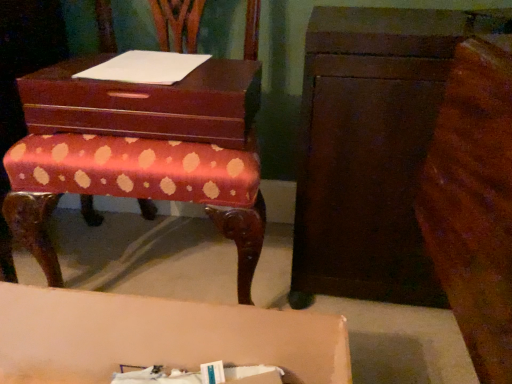
What is the approximate height of dark brown wood chest of drawers at right?

26.48 inches.

What do you see at coordinates (146, 103) in the screenshot?
I see `mahogany wood storage box at center` at bounding box center [146, 103].

At what (x,y) coordinates should I click in order to perform the action: click on white paper at upper center. Please return your answer as a coordinate pair (x, y). Image resolution: width=512 pixels, height=384 pixels. Looking at the image, I should click on (145, 67).

The image size is (512, 384). I want to click on book that is above the matte pink table at lower center (from a real-world perspective), so click(145, 67).

Between white paper at upper center and matte pink table at lower center, which one has more height?

With more height is matte pink table at lower center.

Who is more distant, white paper at upper center or matte pink table at lower center?

Positioned behind is white paper at upper center.

Based on the photo, considering the relative sizes of white paper at upper center and matte pink table at lower center in the image provided, is white paper at upper center thinner than matte pink table at lower center?

No.

Which of these two, white paper at upper center or mahogany wood storage box at center, is bigger?

mahogany wood storage box at center is bigger.

Is white paper at upper center oriented towards mahogany wood storage box at center?

Yes, white paper at upper center is facing mahogany wood storage box at center.

Can you confirm if white paper at upper center is positioned to the left of mahogany wood storage box at center?

Indeed, white paper at upper center is positioned on the left side of mahogany wood storage box at center.

Is white paper at upper center spatially inside mahogany wood storage box at center, or outside of it?

white paper at upper center is contained in mahogany wood storage box at center.

How different are the orientations of mahogany wood storage box at center and polished wood bench at center in degrees?

The angle between the facing direction of mahogany wood storage box at center and the facing direction of polished wood bench at center is 0.522 degrees.

Consider the image. Is mahogany wood storage box at center positioned with its back to polished wood bench at center?

Yes.

Is mahogany wood storage box at center inside or outside of polished wood bench at center?

mahogany wood storage box at center exists entirely within polished wood bench at center.

Can you confirm if mahogany wood storage box at center is positioned to the right of polished wood bench at center?

Incorrect, mahogany wood storage box at center is not on the right side of polished wood bench at center.

From a real-world perspective, is mahogany wood storage box at center under white paper at upper center?

Yes, from a real-world perspective, mahogany wood storage box at center is beneath white paper at upper center.

Can you tell me how much mahogany wood storage box at center and white paper at upper center differ in facing direction?

1.28 degrees.

Can you confirm if mahogany wood storage box at center is smaller than white paper at upper center?

No.

From the image's perspective, does dark brown wood chest of drawers at right appear higher than polished wood bench at center?

No.

Is dark brown wood chest of drawers at right at the left side of polished wood bench at center?

In fact, dark brown wood chest of drawers at right is to the right of polished wood bench at center.

Does dark brown wood chest of drawers at right have a lesser height compared to polished wood bench at center?

Correct, dark brown wood chest of drawers at right is not as tall as polished wood bench at center.

Considering the relative sizes of dark brown wood chest of drawers at right and polished wood bench at center in the image provided, is dark brown wood chest of drawers at right wider than polished wood bench at center?

Incorrect, the width of dark brown wood chest of drawers at right does not surpass that of polished wood bench at center.

Does matte pink table at lower center have a lesser height compared to dark brown wood chest of drawers at right?

Yes.

Which object is closer to the camera, matte pink table at lower center or dark brown wood chest of drawers at right?

Positioned in front is matte pink table at lower center.

Based on their sizes in the image, would you say matte pink table at lower center is bigger or smaller than dark brown wood chest of drawers at right?

matte pink table at lower center is smaller than dark brown wood chest of drawers at right.

From a real-world perspective, is matte pink table at lower center positioned over dark brown wood chest of drawers at right based on gravity?

No.

Which object is closer to the camera taking this photo, dark brown wood chest of drawers at right or white paper at upper center?

dark brown wood chest of drawers at right is in front.

Is dark brown wood chest of drawers at right completely or partially outside of white paper at upper center?

Yes.

Between dark brown wood chest of drawers at right and white paper at upper center, which one appears on the right side from the viewer's perspective?

dark brown wood chest of drawers at right.

In the scene shown: Which is farther, (374, 22) or (167, 60)?

The point (167, 60) is more distant.

There is a matte pink table at lower center. At what (x,y) coordinates should I click in order to perform the action: click on book above it (from a real-world perspective). Please return your answer as a coordinate pair (x, y). Image resolution: width=512 pixels, height=384 pixels. Looking at the image, I should click on (145, 67).

Identify the location of book on the left side of mahogany wood storage box at center. (145, 67).

Based on the photo, based on their spatial positions, is mahogany wood storage box at center or polished wood bench at center further from white paper at upper center?

Based on the image, polished wood bench at center appears to be further to white paper at upper center.

Looking at the image, which one is located further to mahogany wood storage box at center, matte pink table at lower center or dark brown wood chest of drawers at right?

matte pink table at lower center is further to mahogany wood storage box at center.

When comparing their distances from polished wood bench at center, does matte pink table at lower center or mahogany wood storage box at center seem further?

Based on the image, matte pink table at lower center appears to be further to polished wood bench at center.

When comparing their distances from polished wood bench at center, does dark brown wood chest of drawers at right or white paper at upper center seem further?

dark brown wood chest of drawers at right is positioned further to the anchor polished wood bench at center.

From the picture: From the image, which object appears to be nearer to matte pink table at lower center, white paper at upper center or polished wood bench at center?

polished wood bench at center.

When comparing their distances from matte pink table at lower center, does mahogany wood storage box at center or white paper at upper center seem closer?

mahogany wood storage box at center is positioned closer to the anchor matte pink table at lower center.

Looking at the image, which one is located closer to polished wood bench at center, mahogany wood storage box at center or matte pink table at lower center?

mahogany wood storage box at center is positioned closer to the anchor polished wood bench at center.

Considering their positions, is mahogany wood storage box at center positioned closer to polished wood bench at center than dark brown wood chest of drawers at right?

mahogany wood storage box at center is closer to polished wood bench at center.

I want to click on furniture that lies between mahogany wood storage box at center and matte pink table at lower center from top to bottom, so click(141, 150).

Where is `table between white paper at upper center and dark brown wood chest of drawers at right in the horizontal direction`? table between white paper at upper center and dark brown wood chest of drawers at right in the horizontal direction is located at coordinates pyautogui.click(x=158, y=337).

At what (x,y) coordinates should I click in order to perform the action: click on table between polished wood bench at center and dark brown wood chest of drawers at right. Please return your answer as a coordinate pair (x, y). This screenshot has width=512, height=384. Looking at the image, I should click on (158, 337).

Identify the location of storage box located between white paper at upper center and dark brown wood chest of drawers at right in the left-right direction. (146, 103).